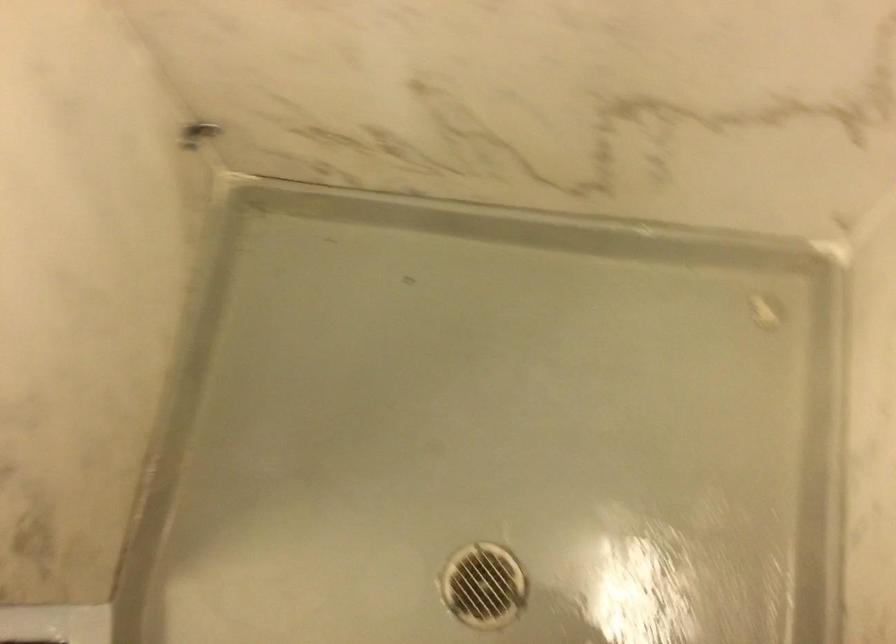
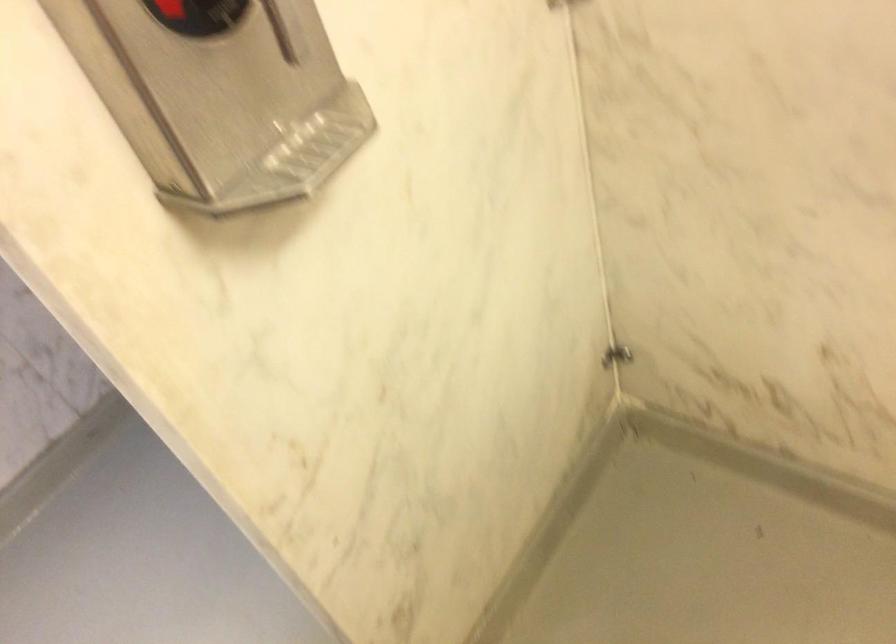
Based on the photo, the first image is from the beginning of the video and the second image is from the end. How did the camera likely rotate when shooting the video?

The camera's rotation is toward left-up.